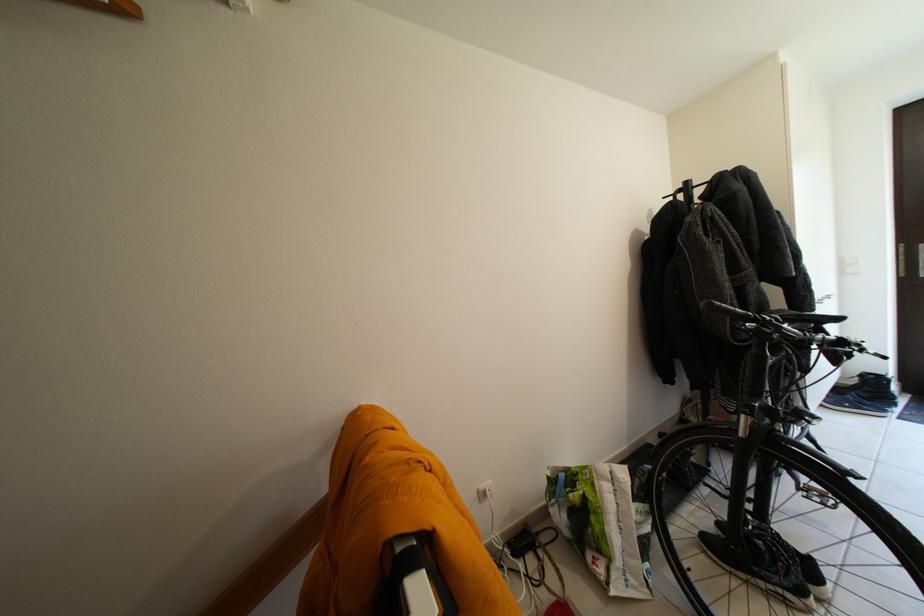
Describe the element at coordinates (909, 363) in the screenshot. The image size is (924, 616). I see `the bicycle brake lever` at that location.